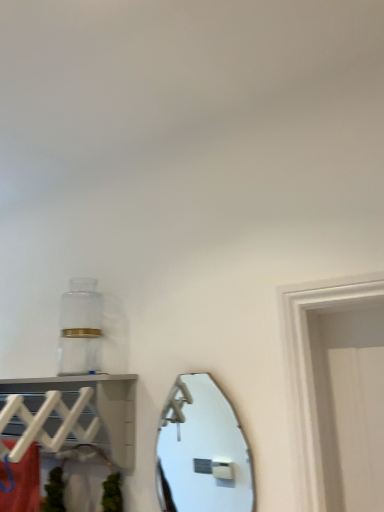
The height and width of the screenshot is (512, 384). I want to click on shiny silver mirror at center, so coord(202,451).

The image size is (384, 512). What do you see at coordinates (202, 451) in the screenshot? I see `shiny silver mirror at center` at bounding box center [202, 451].

Describe the element at coordinates (71, 413) in the screenshot. I see `white plastic shelf at upper left` at that location.

The width and height of the screenshot is (384, 512). Find the location of `white plastic shelf at upper left`. white plastic shelf at upper left is located at coordinates (71, 413).

This screenshot has height=512, width=384. In order to click on shiny silver mirror at center in this screenshot , I will do `click(202, 451)`.

Is white plastic shelf at upper left to the left of shiny silver mirror at center from the viewer's perspective?

Yes, white plastic shelf at upper left is to the left of shiny silver mirror at center.

Which object is closer to the camera taking this photo, white plastic shelf at upper left or shiny silver mirror at center?

white plastic shelf at upper left.

Considering the positions of points (98, 445) and (238, 488), is point (98, 445) farther from camera compared to point (238, 488)?

No, (98, 445) is in front of (238, 488).

From the image's perspective, is white plastic shelf at upper left above shiny silver mirror at center?

Yes.

Based on the photo, from a real-world perspective, is white plastic shelf at upper left above or below shiny silver mirror at center?

From a real-world perspective, white plastic shelf at upper left is physically above shiny silver mirror at center.

Can you confirm if white plastic shelf at upper left is thinner than shiny silver mirror at center?

No, white plastic shelf at upper left is not thinner than shiny silver mirror at center.

Who is shorter, white plastic shelf at upper left or shiny silver mirror at center?

white plastic shelf at upper left.

Considering the relative sizes of white plastic shelf at upper left and shiny silver mirror at center in the image provided, is white plastic shelf at upper left bigger than shiny silver mirror at center?

Yes, white plastic shelf at upper left is bigger than shiny silver mirror at center.

Is shiny silver mirror at center a part of white plastic shelf at upper left?

Definitely not — shiny silver mirror at center is not inside white plastic shelf at upper left.

Does white plastic shelf at upper left touch shiny silver mirror at center?

No, white plastic shelf at upper left is not beside shiny silver mirror at center.

Is white plastic shelf at upper left oriented towards shiny silver mirror at center?

No, white plastic shelf at upper left is not oriented towards shiny silver mirror at center.

How distant is white plastic shelf at upper left from shiny silver mirror at center?

They are 1.62 meters apart.

This screenshot has height=512, width=384. I want to click on mirror on the right of white plastic shelf at upper left, so click(x=202, y=451).

Is shiny silver mirror at center at the left side of white plastic shelf at upper left?

Incorrect, shiny silver mirror at center is not on the left side of white plastic shelf at upper left.

Is shiny silver mirror at center positioned behind white plastic shelf at upper left?

That is True.

Which is nearer, (238, 494) or (57, 433)?

Point (238, 494) is positioned farther from the camera compared to point (57, 433).

From the image's perspective, is shiny silver mirror at center over white plastic shelf at upper left?

Incorrect, from the image's perspective, shiny silver mirror at center is lower than white plastic shelf at upper left.

From a real-world perspective, which object rests below the other?

shiny silver mirror at center.

Does shiny silver mirror at center have a lesser width compared to white plastic shelf at upper left?

Correct, the width of shiny silver mirror at center is less than that of white plastic shelf at upper left.

Considering the relative sizes of shiny silver mirror at center and white plastic shelf at upper left in the image provided, is shiny silver mirror at center taller than white plastic shelf at upper left?

Yes.

Looking at this image, considering the relative sizes of shiny silver mirror at center and white plastic shelf at upper left in the image provided, is shiny silver mirror at center bigger than white plastic shelf at upper left?

Actually, shiny silver mirror at center might be smaller than white plastic shelf at upper left.

Would you say white plastic shelf at upper left is part of shiny silver mirror at center's contents?

No, white plastic shelf at upper left is not a part of shiny silver mirror at center.

From the picture: Is there a large distance between shiny silver mirror at center and white plastic shelf at upper left?

shiny silver mirror at center is positioned a significant distance from white plastic shelf at upper left.

Is shiny silver mirror at center facing towards white plastic shelf at upper left?

No, shiny silver mirror at center is not facing towards white plastic shelf at upper left.

How many degrees apart are the facing directions of shiny silver mirror at center and white plastic shelf at upper left?

There is a 1.21-degree angle between the facing directions of shiny silver mirror at center and white plastic shelf at upper left.

Locate an element on the screen. mirror lying behind the white plastic shelf at upper left is located at coordinates (202, 451).

At what (x,y) coordinates should I click in order to perform the action: click on mirror below the white plastic shelf at upper left (from the image's perspective). Please return your answer as a coordinate pair (x, y). This screenshot has height=512, width=384. Looking at the image, I should click on (202, 451).

This screenshot has width=384, height=512. Identify the location of shelf in front of the shiny silver mirror at center. (71, 413).